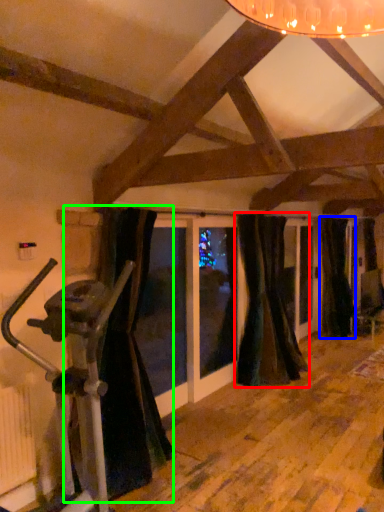
Question: Which object is positioned farthest from curtain (highlighted by a red box)? Select from curtain (highlighted by a blue box) and curtain (highlighted by a green box).

Choices:
 (A) curtain
 (B) curtain

Answer: (B)